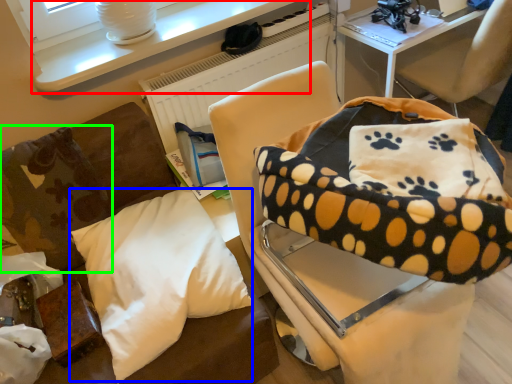
Question: Which is farther away from table (highlighted by a red box)? pillow (highlighted by a blue box) or pillow (highlighted by a green box)?

Choices:
 (A) pillow
 (B) pillow

Answer: (A)